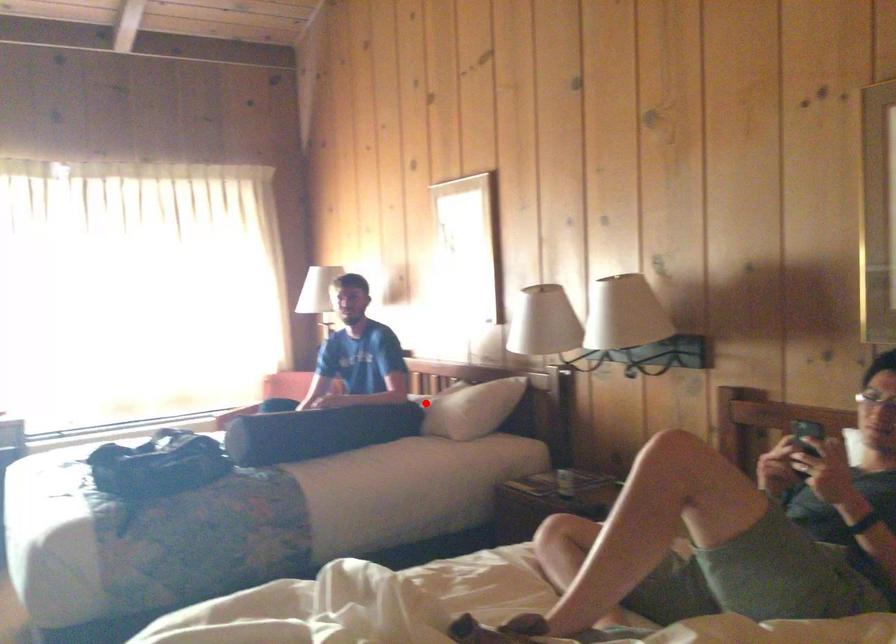
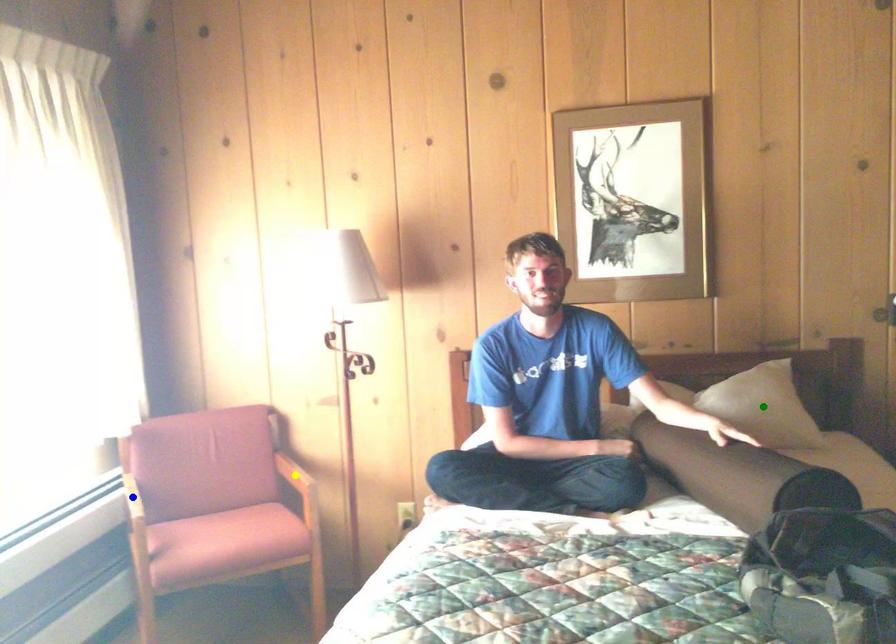
Question: I am providing you with two images of the same scene from different viewpoints. A red point is marked on the first image. You are given multiple points on the second image. Which point in image 2 represents the same 3d spot as the red point in image 1?

Choices:
 (A) blue point
 (B) green point
 (C) yellow point

Answer: (B)